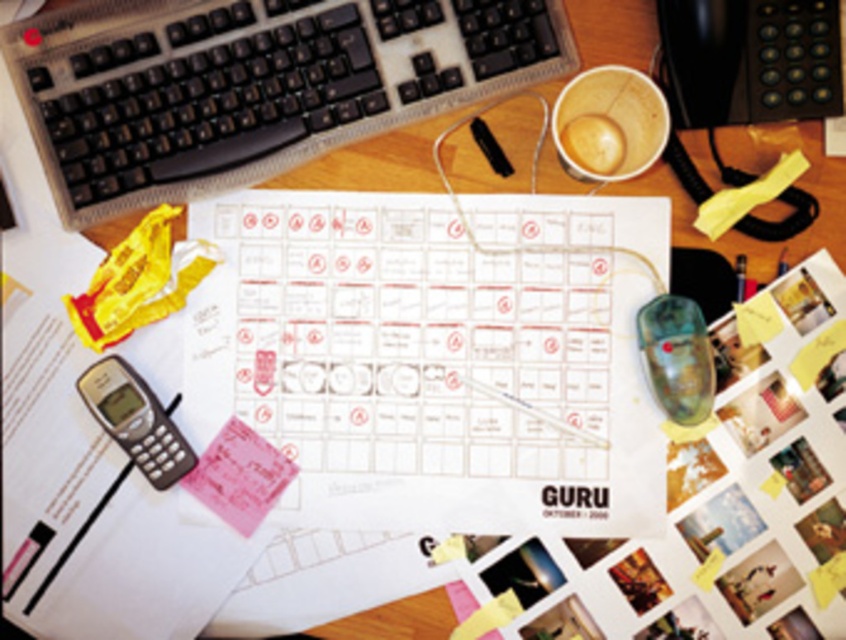
Question: Does black plastic keyboard at upper left have a smaller size compared to gray plastic phone at bottom left?

Choices:
 (A) yes
 (B) no

Answer: (B)

Question: Does black plastic keyboard at upper left have a lesser width compared to gray plastic phone at bottom left?

Choices:
 (A) yes
 (B) no

Answer: (B)

Question: Is black plastic keyboard at upper left bigger than gray plastic phone at bottom left?

Choices:
 (A) yes
 (B) no

Answer: (A)

Question: Which point appears closest to the camera in this image?

Choices:
 (A) (146, 112)
 (B) (116, 388)

Answer: (B)

Question: Among these objects, which one is nearest to the camera?

Choices:
 (A) gray plastic phone at bottom left
 (B) black plastic keyboard at upper left

Answer: (A)